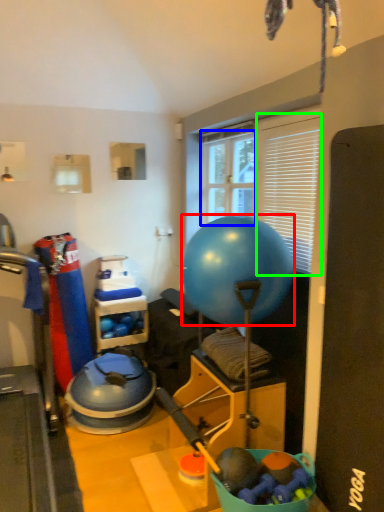
Question: Considering the real-world distances, which object is closest to ball (highlighted by a red box)? window screen (highlighted by a blue box) or window screen (highlighted by a green box).

Choices:
 (A) window screen
 (B) window screen

Answer: (B)